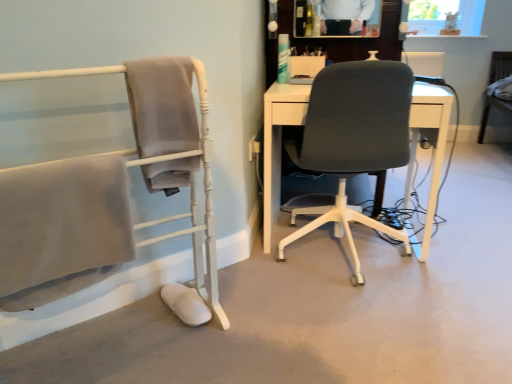
At what (x,y) coordinates should I click in order to perform the action: click on vacant space to the right of matte gray chair at left, which is the first chair in left-to-right order. Please return your answer as a coordinate pair (x, y). This screenshot has height=384, width=512. Looking at the image, I should click on (255, 335).